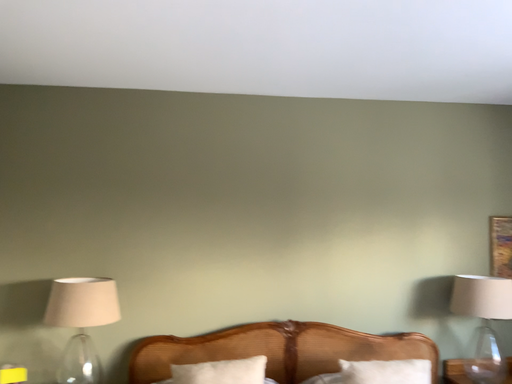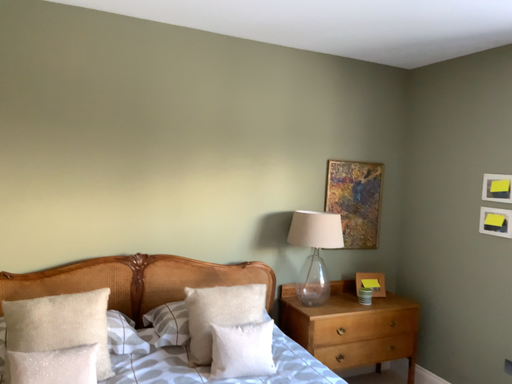
Question: How did the camera likely rotate when shooting the video?

Choices:
 (A) rotated upward
 (B) rotated downward

Answer: (B)